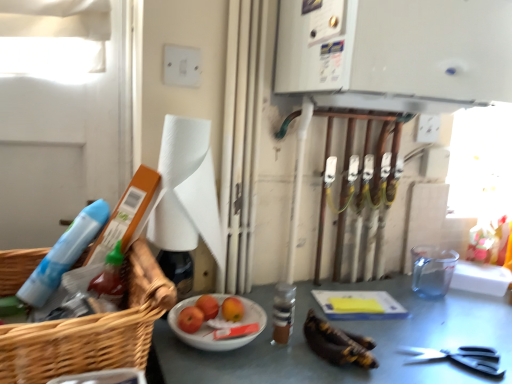
I want to click on free space behind black plastic scissors at lower right, so click(x=435, y=321).